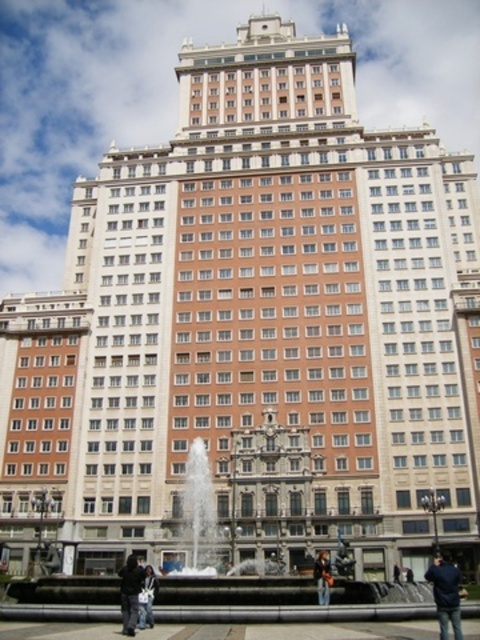
Is denim jacket at lower center positioned behind dark blue jeans at lower center?

No, denim jacket at lower center is closer to the viewer.

Can you confirm if denim jacket at lower center is positioned to the right of dark blue jeans at lower center?

In fact, denim jacket at lower center is to the left of dark blue jeans at lower center.

Is point (148, 592) farther from camera compared to point (398, 580)?

No, it is in front of (398, 580).

The image size is (480, 640). I want to click on denim jacket at lower center, so click(x=146, y=598).

Which of these two, dark blue jacket at lower right or dark gray jacket at lower center, stands shorter?

Standing shorter between the two is dark gray jacket at lower center.

Between dark blue jacket at lower right and dark gray jacket at lower center, which one appears on the left side from the viewer's perspective?

dark gray jacket at lower center is more to the left.

Between point (439, 612) and point (132, 602), which one is positioned behind?

The point (132, 602) is more distant.

This screenshot has height=640, width=480. What are the coordinates of `dark blue jacket at lower right` in the screenshot? It's located at (445, 595).

Which is more to the left, white marble fountain at center or dark blue jeans at lower center?

From the viewer's perspective, white marble fountain at center appears more on the left side.

This screenshot has width=480, height=640. I want to click on white marble fountain at center, so click(197, 516).